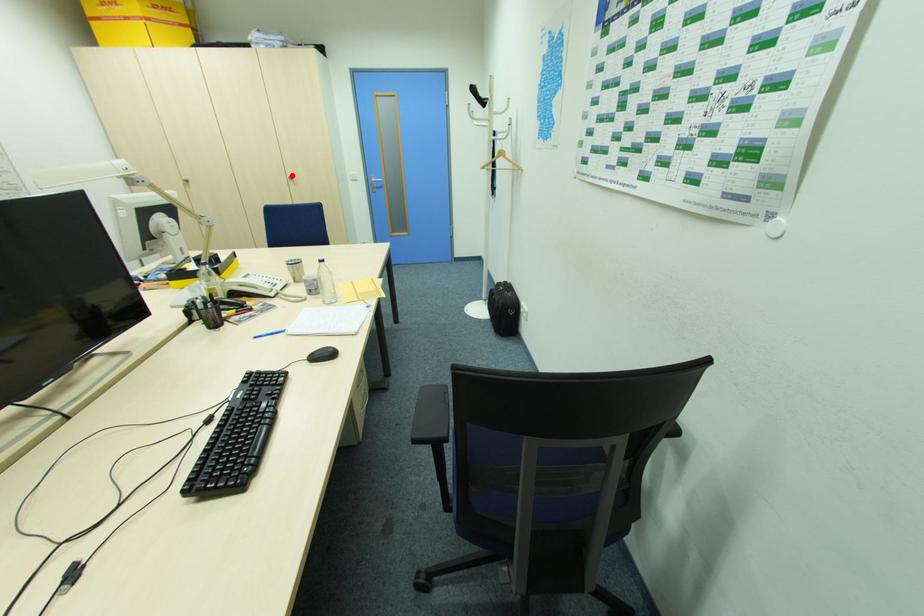
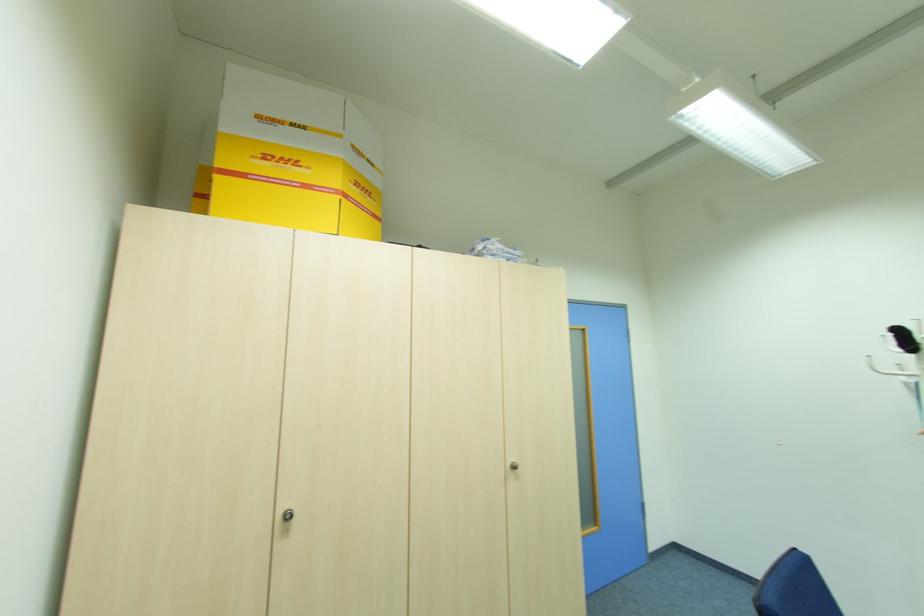
In the second image, find the point that corresponds to the highlighted location in the first image.

(513, 460)